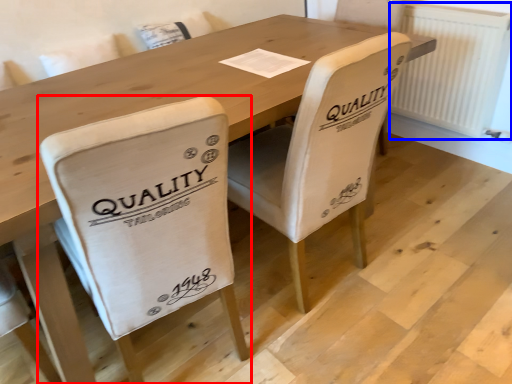
Question: Among these objects, which one is nearest to the camera, chair (highlighted by a red box) or radiator (highlighted by a blue box)?

Choices:
 (A) chair
 (B) radiator

Answer: (A)